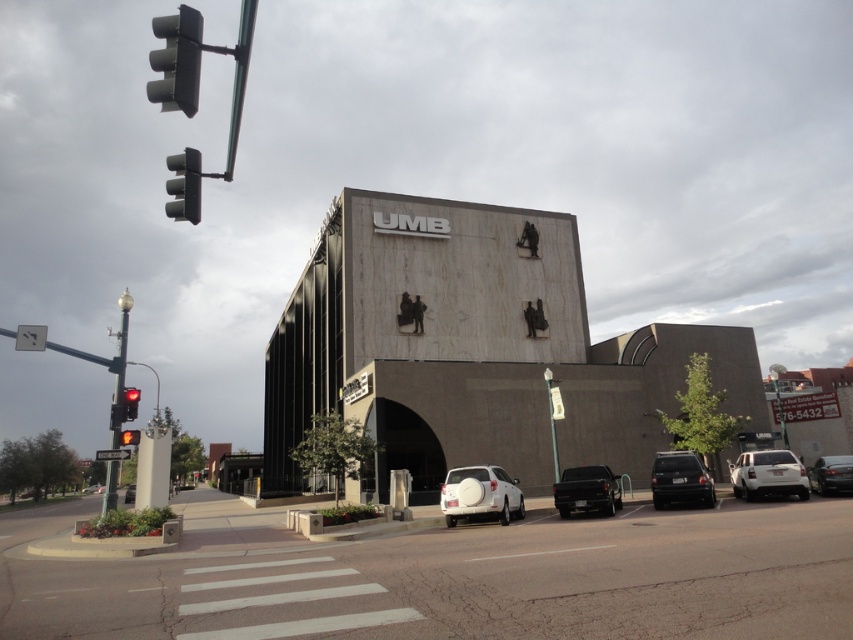
Question: Where is white matte suv at right located in relation to shiny black sedan at right in the image?

Choices:
 (A) left
 (B) right

Answer: (A)

Question: Does white matte suv at right lie in front of metallic traffic light at upper left?

Choices:
 (A) no
 (B) yes

Answer: (A)

Question: Based on their relative distances, which object is nearer to the black matte suv at center-right?

Choices:
 (A) shiny black truck at center
 (B) white matte suv at center
 (C) shiny black sedan at right

Answer: (A)

Question: Which point appears farthest from the camera in this image?

Choices:
 (A) (125, 500)
 (B) (126, 435)
 (C) (593, 508)
 (D) (517, 481)

Answer: (A)

Question: Which point is farther from the camera taking this photo?

Choices:
 (A) (184, 99)
 (B) (660, 461)

Answer: (B)

Question: Can you confirm if black matte suv at center-right is smaller than white matte sedan at lower left?

Choices:
 (A) yes
 (B) no

Answer: (A)